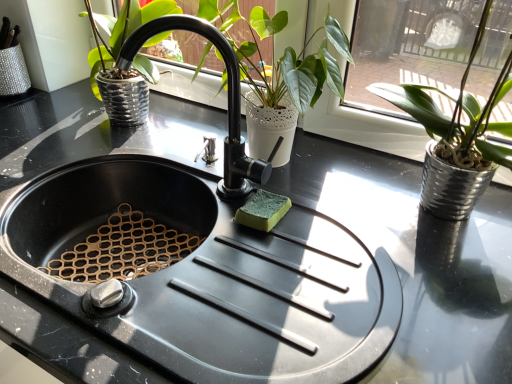
At what (x,y) coordinates should I click in order to perform the action: click on silver metallic pot at right, arranged as the 2th houseplant when viewed from the left. Please return your answer as a coordinate pair (x, y). This screenshot has width=512, height=384. Looking at the image, I should click on (456, 137).

This screenshot has width=512, height=384. In order to click on black matte faucet at center in this screenshot , I will do `click(228, 102)`.

Between white textured pot at center, acting as the 2th houseplant starting from the right, and silver metallic pot at right, the first houseplant from the right, which one is positioned in front?

silver metallic pot at right, the first houseplant from the right, is more forward.

Are white textured pot at center, acting as the 2th houseplant starting from the right, and silver metallic pot at right, the first houseplant from the right, beside each other?

No, white textured pot at center, acting as the 2th houseplant starting from the right, is not in contact with silver metallic pot at right, the first houseplant from the right.

From a real-world perspective, relative to silver metallic pot at right, arranged as the 2th houseplant when viewed from the left, is white textured pot at center, which is the first houseplant in left-to-right order, vertically above or below?

Clearly, from a real-world perspective, white textured pot at center, which is the first houseplant in left-to-right order, is below silver metallic pot at right, arranged as the 2th houseplant when viewed from the left.

In order to click on houseplant below the white textured pot at center, acting as the 2th houseplant starting from the right (from the image's perspective) in this screenshot , I will do `click(456, 137)`.

How different are the orientations of silver metallic pot at right, arranged as the 2th houseplant when viewed from the left, and black matte faucet at center in degrees?

They differ by 0.273 degrees in their facing directions.

Based on the photo, who is bigger, silver metallic pot at right, the first houseplant from the right, or black matte faucet at center?

With larger size is silver metallic pot at right, the first houseplant from the right.

Does silver metallic pot at right, the first houseplant from the right, have a lesser width compared to black matte faucet at center?

Incorrect, the width of silver metallic pot at right, the first houseplant from the right, is not less than that of black matte faucet at center.

Is point (404, 86) less distant than point (243, 178)?

No, (404, 86) is further to viewer.

Which of these two, black matte faucet at center or white textured pot at center, which is the first houseplant in left-to-right order, is bigger?

white textured pot at center, which is the first houseplant in left-to-right order, is bigger.

Is black matte faucet at center located outside white textured pot at center, acting as the 2th houseplant starting from the right?

Yes, black matte faucet at center is outside of white textured pot at center, acting as the 2th houseplant starting from the right.

Based on the photo, from a real-world perspective, who is located lower, black matte faucet at center or white textured pot at center, which is the first houseplant in left-to-right order?

From a 3D spatial view, white textured pot at center, which is the first houseplant in left-to-right order, is below.

Considering the sizes of objects black matte faucet at center and white textured pot at center, which is the first houseplant in left-to-right order, in the image provided, who is taller, black matte faucet at center or white textured pot at center, which is the first houseplant in left-to-right order,?

Standing taller between the two is white textured pot at center, which is the first houseplant in left-to-right order.

Measure the distance between white textured pot at center, acting as the 2th houseplant starting from the right, and black matte faucet at center.

4.48 inches.

From a real-world perspective, is white textured pot at center, acting as the 2th houseplant starting from the right, below black matte faucet at center?

Correct, in the physical world, white textured pot at center, acting as the 2th houseplant starting from the right, is lower than black matte faucet at center.

Does white textured pot at center, acting as the 2th houseplant starting from the right, have a greater width compared to black matte faucet at center?

Yes, white textured pot at center, acting as the 2th houseplant starting from the right, is wider than black matte faucet at center.

Which of these two, white textured pot at center, acting as the 2th houseplant starting from the right, or black matte faucet at center, stands shorter?

With less height is black matte faucet at center.

Could you measure the distance between black matte faucet at center and silver metallic pot at right, arranged as the 2th houseplant when viewed from the left?

38.09 centimeters.

Which object is more forward, black matte faucet at center or silver metallic pot at right, arranged as the 2th houseplant when viewed from the left?

silver metallic pot at right, arranged as the 2th houseplant when viewed from the left, is in front.

Is black matte faucet at center not within silver metallic pot at right, arranged as the 2th houseplant when viewed from the left?

Yes, black matte faucet at center is outside of silver metallic pot at right, arranged as the 2th houseplant when viewed from the left.

Does black matte faucet at center appear on the left side of silver metallic pot at right, the first houseplant from the right?

Indeed, black matte faucet at center is positioned on the left side of silver metallic pot at right, the first houseplant from the right.

Identify the location of houseplant located below the white textured pot at center, acting as the 2th houseplant starting from the right (from the image's perspective). (456, 137).

Does silver metallic pot at right, arranged as the 2th houseplant when viewed from the left, appear on the right side of white textured pot at center, acting as the 2th houseplant starting from the right?

Yes, silver metallic pot at right, arranged as the 2th houseplant when viewed from the left, is to the right of white textured pot at center, acting as the 2th houseplant starting from the right.

From a real-world perspective, which is physically above, silver metallic pot at right, the first houseplant from the right, or white textured pot at center, acting as the 2th houseplant starting from the right?

silver metallic pot at right, the first houseplant from the right, is physically above.

From the image's perspective, which object appears higher, silver metallic pot at right, the first houseplant from the right, or white textured pot at center, which is the first houseplant in left-to-right order?

From the image's view, white textured pot at center, which is the first houseplant in left-to-right order, is above.

Locate an element on the screen. The height and width of the screenshot is (384, 512). houseplant that is behind the silver metallic pot at right, the first houseplant from the right is located at coordinates (283, 58).

The width and height of the screenshot is (512, 384). I want to click on faucet below the silver metallic pot at right, the first houseplant from the right (from a real-world perspective), so click(228, 102).

Which object lies nearer to the anchor point white textured pot at center, acting as the 2th houseplant starting from the right, silver metallic pot at right, the first houseplant from the right, or black matte faucet at center?

Among the two, black matte faucet at center is located nearer to white textured pot at center, acting as the 2th houseplant starting from the right.

When comparing their distances from silver metallic pot at right, the first houseplant from the right, does black matte faucet at center or white textured pot at center, which is the first houseplant in left-to-right order, seem further?

black matte faucet at center.

Considering their positions, is white textured pot at center, which is the first houseplant in left-to-right order, positioned closer to black matte faucet at center than silver metallic pot at right, arranged as the 2th houseplant when viewed from the left?

white textured pot at center, which is the first houseplant in left-to-right order, is positioned closer to the anchor black matte faucet at center.

Which object lies further to the anchor point white textured pot at center, acting as the 2th houseplant starting from the right, black matte faucet at center or silver metallic pot at right, the first houseplant from the right?

silver metallic pot at right, the first houseplant from the right, is further to white textured pot at center, acting as the 2th houseplant starting from the right.

Which object lies nearer to the anchor point black matte faucet at center, silver metallic pot at right, the first houseplant from the right, or white textured pot at center, acting as the 2th houseplant starting from the right?

white textured pot at center, acting as the 2th houseplant starting from the right, is closer to black matte faucet at center.

From the image, which object appears to be farther from silver metallic pot at right, the first houseplant from the right, white textured pot at center, which is the first houseplant in left-to-right order, or black matte faucet at center?

The object further to silver metallic pot at right, the first houseplant from the right, is black matte faucet at center.

Locate an element on the screen. houseplant situated between black matte faucet at center and silver metallic pot at right, the first houseplant from the right, from left to right is located at coordinates (283, 58).